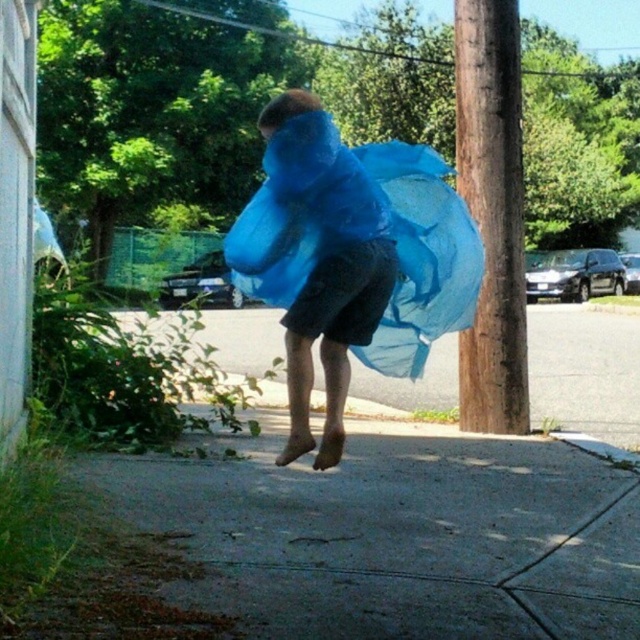
Question: Is blue translucent fabric at center above blue sheer fabric at center?

Choices:
 (A) no
 (B) yes

Answer: (A)

Question: Which of the following is the closest to the observer?

Choices:
 (A) (406, 547)
 (B) (509, 154)
 (C) (387, 237)
 (D) (314, 467)

Answer: (C)

Question: Considering the real-world distances, which object is closest to the gray concrete pavement at lower center?

Choices:
 (A) blue sheer fabric at center
 (B) blue translucent fabric at center

Answer: (B)

Question: Considering the relative positions of blue translucent fabric at center and blue sheer fabric at center in the image provided, where is blue translucent fabric at center located with respect to blue sheer fabric at center?

Choices:
 (A) left
 (B) right

Answer: (A)

Question: Which object is the farthest from the gray concrete pavement at lower center?

Choices:
 (A) brown rough wood pole at center right
 (B) blue translucent fabric at center
 (C) blue sheer fabric at center

Answer: (A)

Question: Can you confirm if gray concrete pavement at lower center is positioned to the left of blue sheer fabric at center?

Choices:
 (A) yes
 (B) no

Answer: (B)